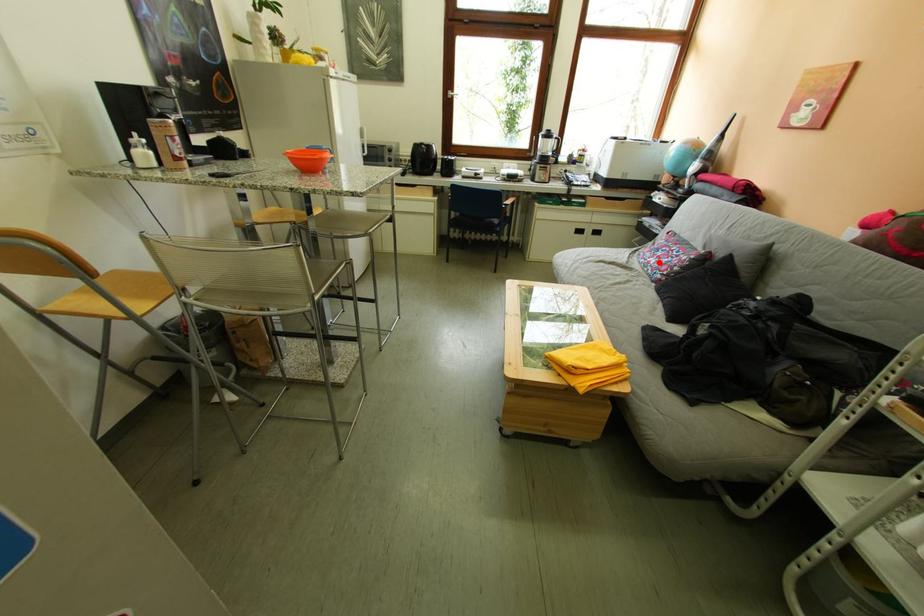
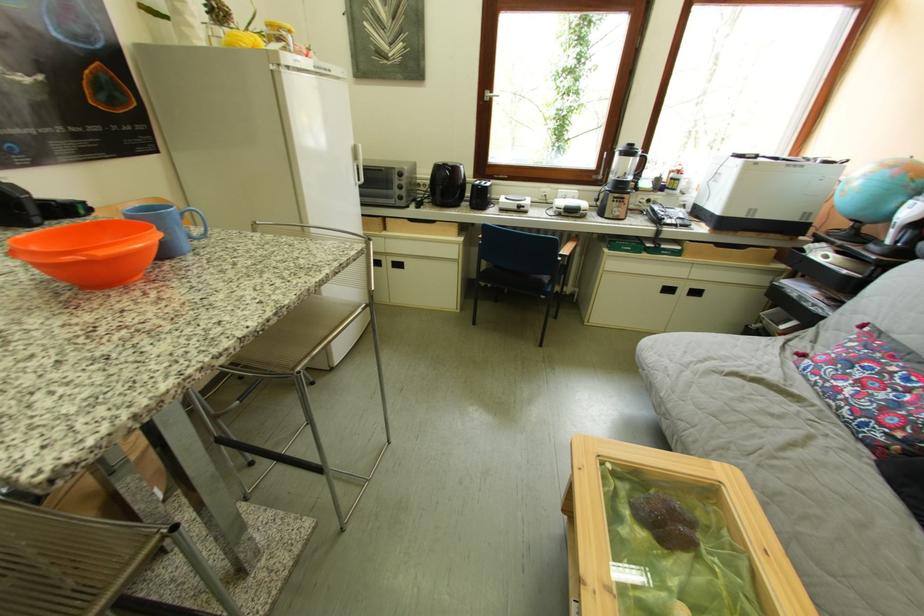
Where in the second image is the point corresponding to the highlighted location from the first image?

(841, 384)